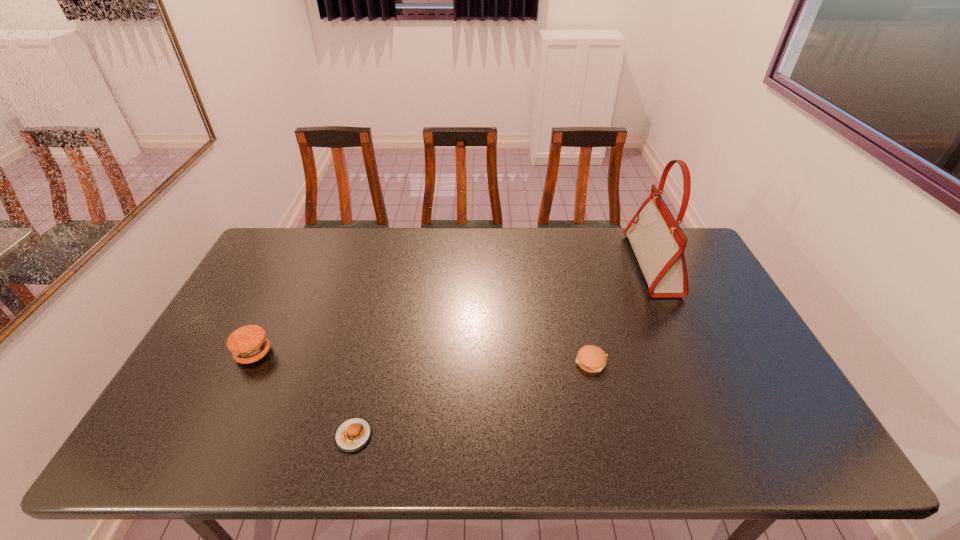
In order to click on vacant space located 0.300m on the back of the second shortest object in this screenshot , I will do `click(571, 277)`.

Find the location of a particular element. This screenshot has height=540, width=960. vacant space located on the back of the third object from right to left is located at coordinates (372, 360).

At what (x,y) coordinates should I click in order to perform the action: click on object present at the far edge. Please return your answer as a coordinate pair (x, y). Looking at the image, I should click on (658, 242).

This screenshot has height=540, width=960. I want to click on object that is at the near edge, so click(353, 434).

Image resolution: width=960 pixels, height=540 pixels. Find the location of `object that is at the left edge`. object that is at the left edge is located at coordinates (248, 344).

Where is `object that is positioned at the right edge`? The image size is (960, 540). object that is positioned at the right edge is located at coordinates (658, 242).

You are a GUI agent. You are given a task and a screenshot of the screen. Output one action in this format:
    pyautogui.click(x=<x>, y=<y>)
    Task: Click on the object that is positioned at the far right corner
    The width and height of the screenshot is (960, 540).
    Given the screenshot: What is the action you would take?
    pyautogui.click(x=658, y=242)

At what (x,y) coordinates should I click in order to perform the action: click on vacant area at the far edge. Please return your answer as a coordinate pair (x, y). Looking at the image, I should click on tap(400, 234).

Where is `free space at the near edge of the desktop`? The image size is (960, 540). free space at the near edge of the desktop is located at coordinates (466, 430).

In the image, there is a desktop. Where is `vacant space at the left edge`? The image size is (960, 540). vacant space at the left edge is located at coordinates (231, 318).